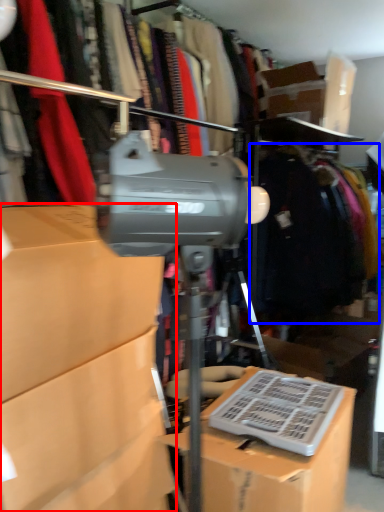
Question: Which of the following is the farthest to the observer, box (highlighted by a red box) or clothing (highlighted by a blue box)?

Choices:
 (A) box
 (B) clothing

Answer: (B)